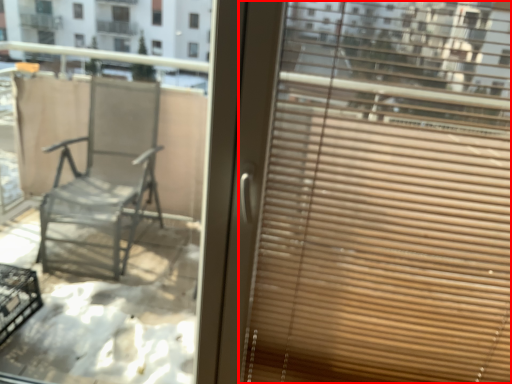
Question: From the image's perspective, what is the correct spatial positioning of window blind (annotated by the red box) in reference to window?

Choices:
 (A) above
 (B) below

Answer: (B)